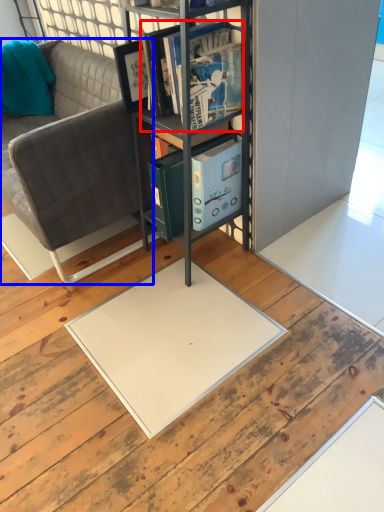
Question: Which of the following is the closest to the observer, book (highlighted by a red box) or studio couch (highlighted by a blue box)?

Choices:
 (A) book
 (B) studio couch

Answer: (A)